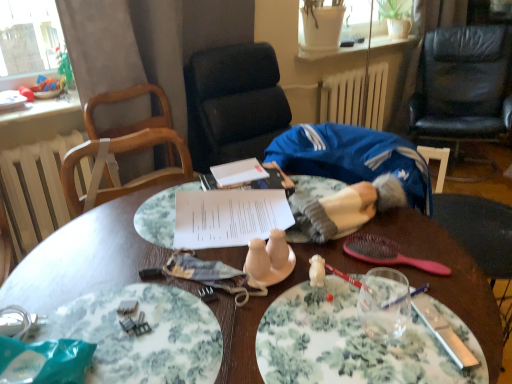
You are a GUI agent. You are given a task and a screenshot of the screen. Output one action in this format:
    pyautogui.click(x=<x>, y=<y>)
    Task: Click on the vacant space behind pink plastic spoon at lower right
    The width and height of the screenshot is (512, 384).
    Given the screenshot: What is the action you would take?
    pyautogui.click(x=387, y=226)